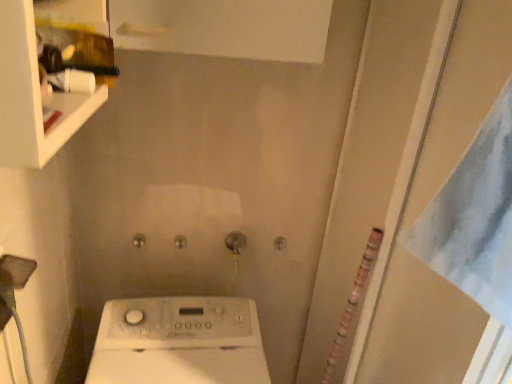
Question: Is transparent plastic screen door at right in front of or behind white glossy shelf at upper left in the image?

Choices:
 (A) behind
 (B) front

Answer: (A)

Question: From the image's perspective, is transparent plastic screen door at right located above or below white glossy shelf at upper left?

Choices:
 (A) below
 (B) above

Answer: (A)

Question: Considering the positions of transparent plastic screen door at right and white glossy shelf at upper left in the image, is transparent plastic screen door at right wider or thinner than white glossy shelf at upper left?

Choices:
 (A) wide
 (B) thin

Answer: (B)

Question: From a real-world perspective, is white glossy shelf at upper left above or below transparent plastic screen door at right?

Choices:
 (A) above
 (B) below

Answer: (A)

Question: In terms of height, does white glossy shelf at upper left look taller or shorter compared to transparent plastic screen door at right?

Choices:
 (A) tall
 (B) short

Answer: (B)

Question: Which is correct: white glossy shelf at upper left is inside transparent plastic screen door at right, or outside of it?

Choices:
 (A) inside
 (B) outside

Answer: (B)

Question: From the image's perspective, is white glossy shelf at upper left above or below transparent plastic screen door at right?

Choices:
 (A) below
 (B) above

Answer: (B)